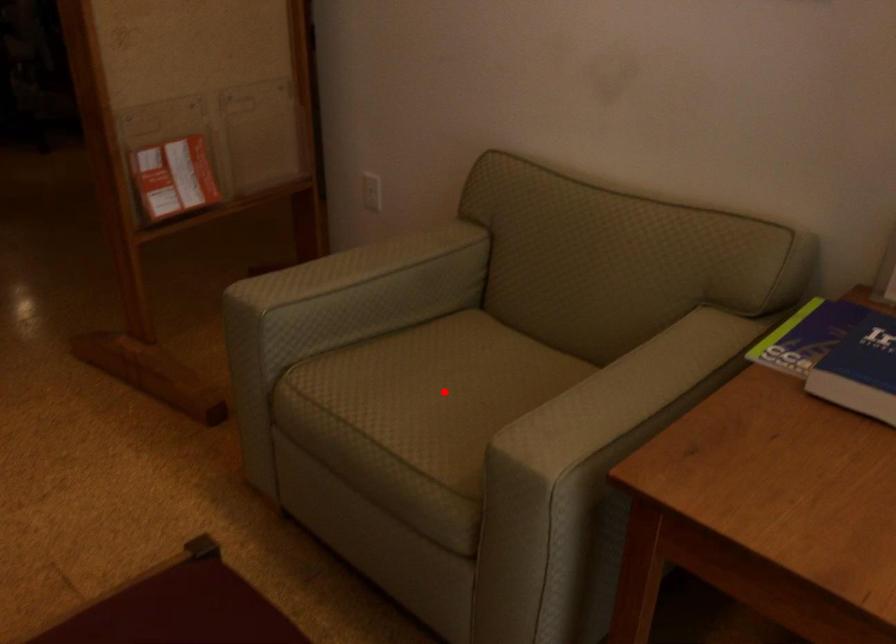
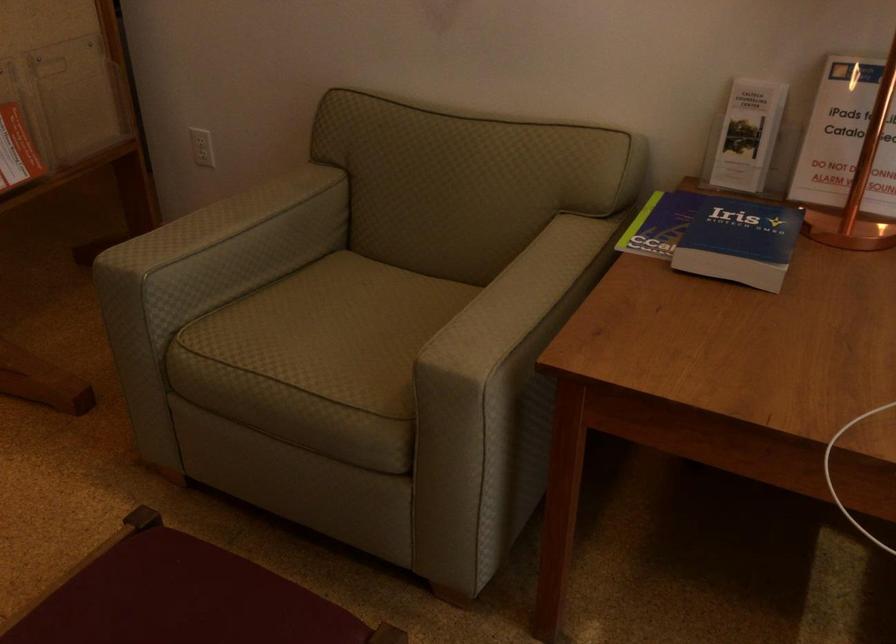
Locate, in the second image, the point that corresponds to the highlighted location in the first image.

(343, 325)